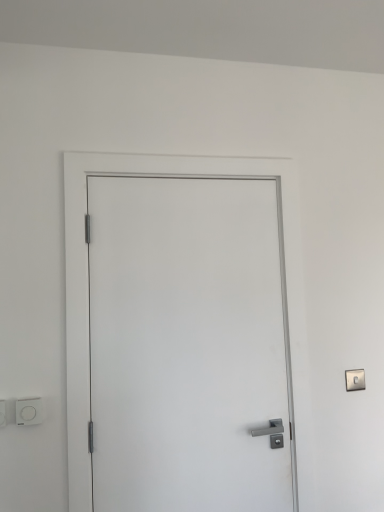
You are a GUI agent. You are given a task and a screenshot of the screen. Output one action in this format:
    pyautogui.click(x=<x>, y=<y>)
    Task: Click on the white plastic light switch at lower left
    The image size is (384, 512).
    Given the screenshot: What is the action you would take?
    pyautogui.click(x=29, y=411)

This screenshot has height=512, width=384. What do you see at coordinates (29, 411) in the screenshot?
I see `white plastic light switch at lower left` at bounding box center [29, 411].

The width and height of the screenshot is (384, 512). I want to click on white matte door at center, so click(188, 345).

What do you see at coordinates (188, 345) in the screenshot? I see `white matte door at center` at bounding box center [188, 345].

Locate an element on the screen. This screenshot has width=384, height=512. white plastic light switch at lower left is located at coordinates (29, 411).

Visually, is white matte door at center positioned to the left or to the right of white plastic light switch at lower left?

white matte door at center is positioned on white plastic light switch at lower left's right side.

Looking at this image, between white matte door at center and white plastic light switch at lower left, which one is positioned in front?

white matte door at center is more forward.

Considering the positions of points (162, 286) and (19, 413), is point (162, 286) farther from camera compared to point (19, 413)?

Yes, point (162, 286) is behind point (19, 413).

From the image's perspective, is white matte door at center on top of white plastic light switch at lower left?

Indeed, from the image's perspective, white matte door at center is shown above white plastic light switch at lower left.

From a real-world perspective, is white matte door at center under white plastic light switch at lower left?

No, from a real-world perspective, white matte door at center is not beneath white plastic light switch at lower left.

Can you confirm if white matte door at center is thinner than white plastic light switch at lower left?

No.

Is white matte door at center shorter than white plastic light switch at lower left?

In fact, white matte door at center may be taller than white plastic light switch at lower left.

Considering the sizes of objects white matte door at center and white plastic light switch at lower left in the image provided, who is bigger, white matte door at center or white plastic light switch at lower left?

white matte door at center is bigger.

Is white matte door at center inside the boundaries of white plastic light switch at lower left, or outside?

white matte door at center lies outside white plastic light switch at lower left.

Can you see white matte door at center touching white plastic light switch at lower left?

No, white matte door at center is not making contact with white plastic light switch at lower left.

Does white matte door at center turn towards white plastic light switch at lower left?

No, white matte door at center is not turned towards white plastic light switch at lower left.

Consider the image. What's the angular difference between white matte door at center and white plastic light switch at lower left's facing directions?

There is a 0.282-degree angle between the facing directions of white matte door at center and white plastic light switch at lower left.

This screenshot has width=384, height=512. I want to click on light switch located underneath the white matte door at center (from a real-world perspective), so (29, 411).

Looking at this image, which is more to the left, white plastic light switch at lower left or white matte door at center?

white plastic light switch at lower left.

Is white plastic light switch at lower left closer to the viewer compared to white matte door at center?

No, the depth of white plastic light switch at lower left is greater than that of white matte door at center.

Which is farther from the camera, (x=35, y=422) or (x=281, y=481)?

Point (x=281, y=481)

From the image's perspective, which object appears higher, white plastic light switch at lower left or white matte door at center?

white matte door at center, from the image's perspective.

From a real-world perspective, which object stands above the other?

In real-world perspective, white matte door at center is above.

Is white plastic light switch at lower left thinner than white matte door at center?

Indeed, white plastic light switch at lower left has a lesser width compared to white matte door at center.

In terms of height, does white plastic light switch at lower left look taller or shorter compared to white matte door at center?

white plastic light switch at lower left is shorter than white matte door at center.

Between white plastic light switch at lower left and white matte door at center, which one has smaller size?

white plastic light switch at lower left is smaller.

Is white plastic light switch at lower left spatially inside white matte door at center, or outside of it?

white plastic light switch at lower left exists outside the volume of white matte door at center.

Is white plastic light switch at lower left directly adjacent to white matte door at center?

There is a gap between white plastic light switch at lower left and white matte door at center.

Is white plastic light switch at lower left looking in the opposite direction of white matte door at center?

white plastic light switch at lower left does not have its back to white matte door at center.

How distant is white plastic light switch at lower left from white matte door at center?

white plastic light switch at lower left is 64.38 centimeters away from white matte door at center.

You are a GUI agent. You are given a task and a screenshot of the screen. Output one action in this format:
    pyautogui.click(x=<x>, y=<y>)
    Task: Click on the door in front of the white plastic light switch at lower left
    This screenshot has width=384, height=512.
    Given the screenshot: What is the action you would take?
    pyautogui.click(x=188, y=345)

This screenshot has height=512, width=384. Find the location of `door above the white plastic light switch at lower left (from the image's perspective)`. door above the white plastic light switch at lower left (from the image's perspective) is located at coordinates (188, 345).

What are the coordinates of `door above the white plastic light switch at lower left (from a real-world perspective)` in the screenshot? It's located at (188, 345).